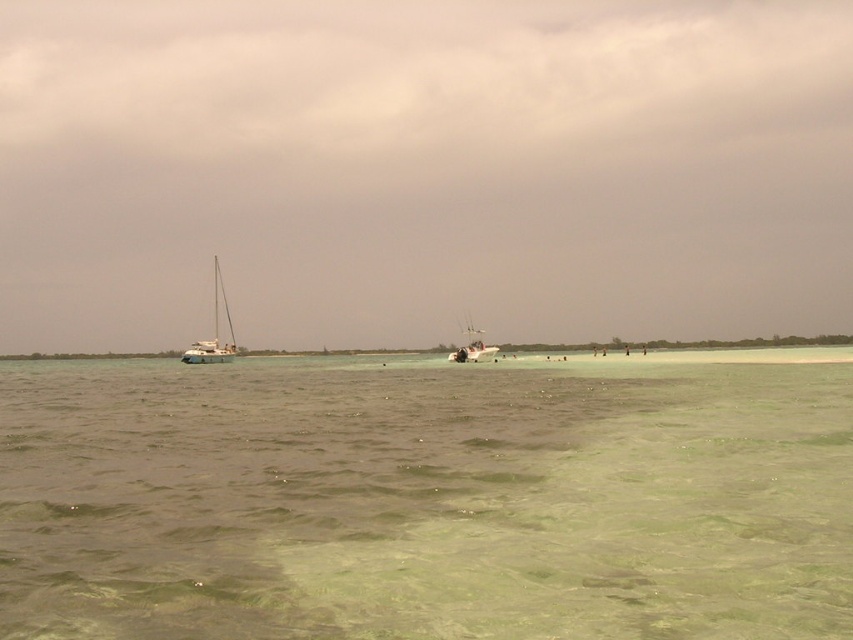
Question: Which of the following is the farthest from the observer?

Choices:
 (A) green translucent water at center
 (B) white matte boat at center
 (C) white matte sailboat at left

Answer: (C)

Question: Can you confirm if green translucent water at center is wider than white matte sailboat at left?

Choices:
 (A) yes
 (B) no

Answer: (A)

Question: Observing the image, what is the correct spatial positioning of green translucent water at center in reference to white matte sailboat at left?

Choices:
 (A) above
 (B) below

Answer: (B)

Question: Estimate the real-world distances between objects in this image. Which object is closer to the white matte sailboat at left?

Choices:
 (A) white matte boat at center
 (B) green translucent water at center

Answer: (A)

Question: Among these objects, which one is nearest to the camera?

Choices:
 (A) white matte sailboat at left
 (B) green translucent water at center

Answer: (B)

Question: Can you confirm if green translucent water at center is positioned below white matte sailboat at left?

Choices:
 (A) no
 (B) yes

Answer: (B)